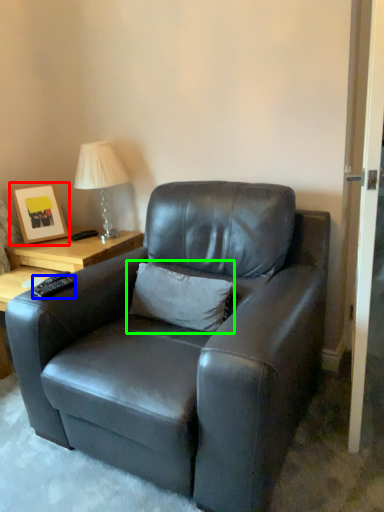
Question: Considering the real-world distances, which object is farthest from picture frame (highlighted by a red box)? remote (highlighted by a blue box) or pillow (highlighted by a green box)?

Choices:
 (A) remote
 (B) pillow

Answer: (B)